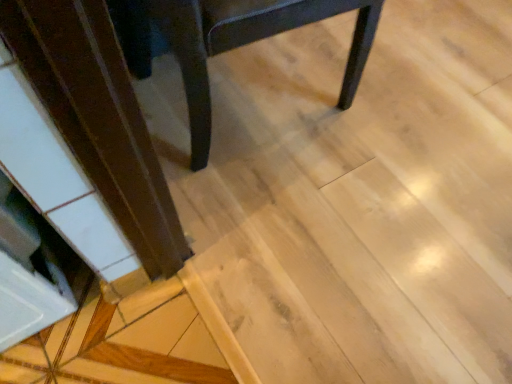
Question: Is light brown wood at lower left closer to the viewer compared to matte black chair at center?

Choices:
 (A) no
 (B) yes

Answer: (A)

Question: From the image's perspective, would you say light brown wood at lower left is shown under matte black chair at center?

Choices:
 (A) no
 (B) yes

Answer: (B)

Question: From a real-world perspective, is light brown wood at lower left physically below matte black chair at center?

Choices:
 (A) yes
 (B) no

Answer: (A)

Question: Is matte black chair at center at the back of light brown wood at lower left?

Choices:
 (A) no
 (B) yes

Answer: (A)

Question: Can you confirm if light brown wood at lower left is positioned to the left of matte black chair at center?

Choices:
 (A) no
 (B) yes

Answer: (B)

Question: Is light brown wood at lower left not close to matte black chair at center?

Choices:
 (A) yes
 (B) no

Answer: (B)

Question: Is matte black chair at center further to the viewer compared to light brown wood at lower left?

Choices:
 (A) yes
 (B) no

Answer: (B)

Question: From a real-world perspective, is matte black chair at center beneath light brown wood at lower left?

Choices:
 (A) no
 (B) yes

Answer: (A)

Question: Can you confirm if matte black chair at center is wider than light brown wood at lower left?

Choices:
 (A) no
 (B) yes

Answer: (B)

Question: From the image's perspective, is matte black chair at center located above light brown wood at lower left?

Choices:
 (A) yes
 (B) no

Answer: (A)

Question: Is matte black chair at center aimed at light brown wood at lower left?

Choices:
 (A) yes
 (B) no

Answer: (B)

Question: Is matte black chair at center positioned with its back to light brown wood at lower left?

Choices:
 (A) no
 (B) yes

Answer: (B)

Question: Relative to matte black chair at center, is light brown wood at lower left in front or behind?

Choices:
 (A) behind
 (B) front

Answer: (A)